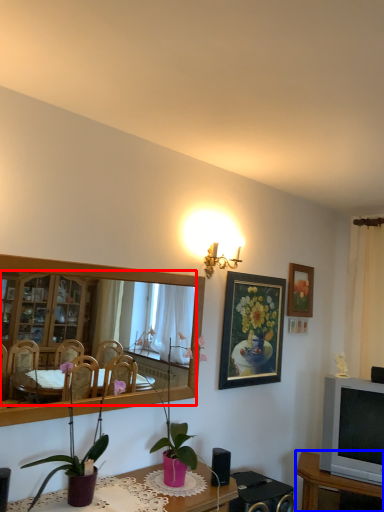
Question: Which object is further to the camera taking this photo, mirror (highlighted by a red box) or table (highlighted by a blue box)?

Choices:
 (A) mirror
 (B) table

Answer: (B)